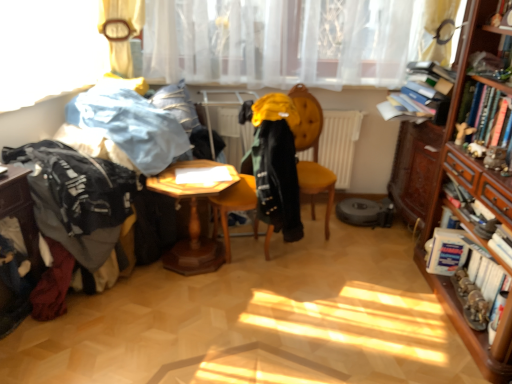
Question: From the image's perspective, is white matte radiator at center above or below yellow fabric coat at center, the 3th clothing from the left?

Choices:
 (A) below
 (B) above

Answer: (B)

Question: Based on their positions, is white matte radiator at center located to the left or right of yellow fabric coat at center, the 3th clothing from the left?

Choices:
 (A) right
 (B) left

Answer: (A)

Question: Estimate the real-world distances between objects in this image. Which object is farther from the wooden hexagonal table at lower left, the 1th table when ordered from left to right?

Choices:
 (A) hardcover book at right, acting as the second book starting from the top
 (B) yellow fabric coat at center, the 3th clothing from the left
 (C) white matte radiator at center
 (D) velvet yellow chair at center
 (E) wooden hexagonal table at center, marked as the second table in a left-to-right arrangement

Answer: (A)

Question: Estimate the real-world distances between objects in this image. Which object is farther from the dark gray fabric at left, the 1th clothing positioned from the left?

Choices:
 (A) yellow fabric coat at center, the 1th clothing in the right-to-left sequence
 (B) translucent white curtain at upper center
 (C) hardcover book at right, placed as the 1th book when sorted from bottom to top
 (D) yellow fabric swivel chair at center
 (E) hardcover book at right, the 2th book in the bottom-to-top sequence

Answer: (E)